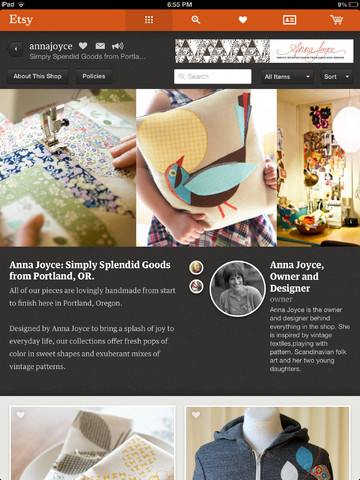
Find the location of a particular element. cusion is located at coordinates (232, 133).